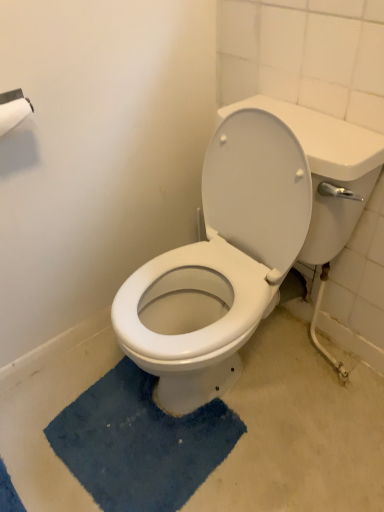
The image size is (384, 512). What do you see at coordinates (140, 443) in the screenshot?
I see `blue plush bath mat at lower center` at bounding box center [140, 443].

In order to face blue plush bath mat at lower center, should I rotate leftwards or rightwards?

Turn left approximately 6.840 degrees to face it.

You are a GUI agent. You are given a task and a screenshot of the screen. Output one action in this format:
    pyautogui.click(x=<x>, y=<y>)
    Task: Click on the blue plush bath mat at lower center
    
    Given the screenshot: What is the action you would take?
    pyautogui.click(x=140, y=443)

Identify the location of blue plush bath mat at lower center. Image resolution: width=384 pixels, height=512 pixels. (140, 443).